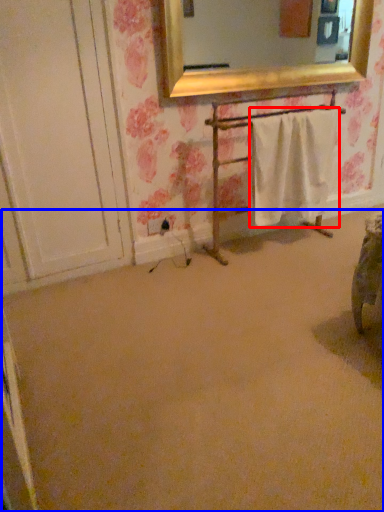
Question: Which of the following is the closest to the observer, bath towel (highlighted by a red box) or plain (highlighted by a blue box)?

Choices:
 (A) bath towel
 (B) plain

Answer: (B)